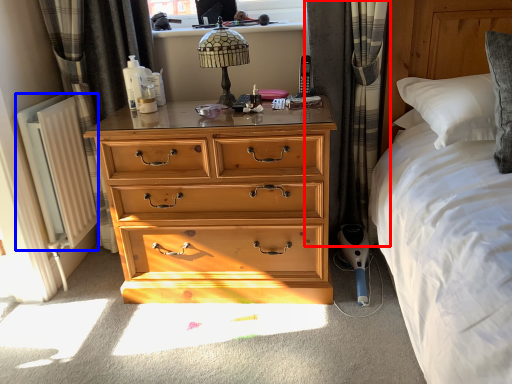
Question: Which object appears closest to the camera in this image, curtain (highlighted by a red box) or radiator (highlighted by a blue box)?

Choices:
 (A) curtain
 (B) radiator

Answer: (A)